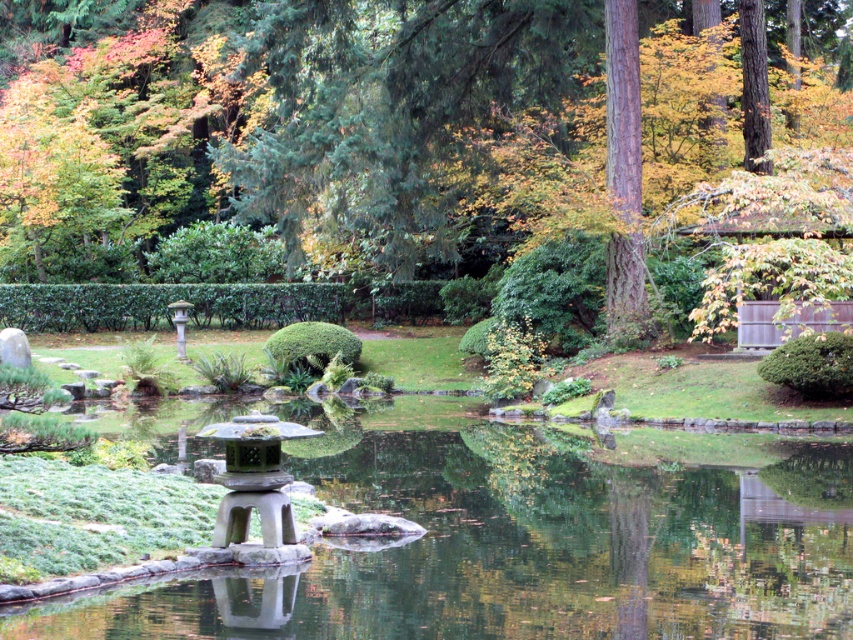
Question: Among these objects, which one is farthest from the camera?

Choices:
 (A) green textured bush at right
 (B) green leafy hedge at center
 (C) green leafy bush at center

Answer: (B)

Question: Which point is closer to the camera?

Choices:
 (A) (415, 310)
 (B) (672, 604)
 (C) (294, 333)
 (D) (682, 81)

Answer: (B)

Question: Can you confirm if green stone water at center is smaller than green leafy hedge at center?

Choices:
 (A) no
 (B) yes

Answer: (A)

Question: Observing the image, what is the correct spatial positioning of brown textured tree at upper center in reference to smooth stone lantern at center?

Choices:
 (A) left
 (B) right

Answer: (B)

Question: Which point is closer to the camera?

Choices:
 (A) (19, 323)
 (B) (155, 588)

Answer: (B)

Question: Does green stone water at center appear on the right side of green leafy bush at center?

Choices:
 (A) no
 (B) yes

Answer: (B)